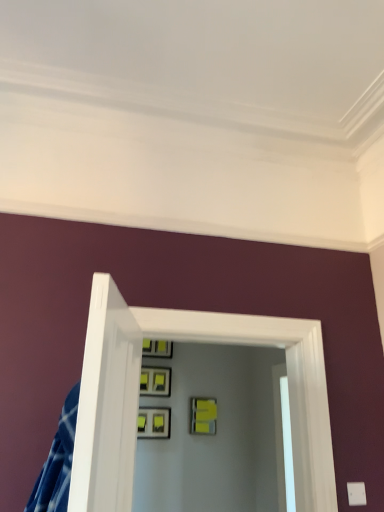
This screenshot has width=384, height=512. What do you see at coordinates (138, 396) in the screenshot?
I see `clear glass door at center` at bounding box center [138, 396].

Find the location of `matte black picture frame at upper center, which is the fourth picture frame in bottom-to-top order`. matte black picture frame at upper center, which is the fourth picture frame in bottom-to-top order is located at coordinates (157, 348).

In order to face matte yellow picture frame at center, positioned as the 2th picture frame in bottom-to-top order, should I rotate leftwards or rightwards?

To face it directly, rotate right by 1.646 degrees.

Locate an element on the screen. This screenshot has width=384, height=512. matte gray picture frame at center, positioned as the 1th picture frame in bottom-to-top order is located at coordinates (153, 422).

What are the coordinates of `clear glass door at center` in the screenshot? It's located at (138, 396).

Is point (155, 356) less distant than point (167, 390)?

No.

Which object is positioned more to the right, matte black picture frame at upper center, the first picture frame positioned from the top, or matte black picture frame at center, the 2th picture frame viewed from the top?

Positioned to the right is matte black picture frame at upper center, the first picture frame positioned from the top.

Is matte black picture frame at upper center, the first picture frame positioned from the top, bigger than matte black picture frame at center, which appears as the 3th picture frame when ordered from the bottom?

Correct, matte black picture frame at upper center, the first picture frame positioned from the top, is larger in size than matte black picture frame at center, which appears as the 3th picture frame when ordered from the bottom.

Is the position of matte black picture frame at center, the 2th picture frame viewed from the top, more distant than that of matte gray picture frame at center, positioned as the 1th picture frame in bottom-to-top order?

Yes, matte black picture frame at center, the 2th picture frame viewed from the top, is further from the camera.

The width and height of the screenshot is (384, 512). What are the coordinates of `picture frame that appears on the left of matte black picture frame at center, the 2th picture frame viewed from the top` in the screenshot? It's located at (153, 422).

Between point (153, 372) and point (140, 411), which one is positioned in front?

The point (140, 411) is closer to the camera.

Is matte black picture frame at center, which appears as the 3th picture frame when ordered from the bottom, to the right of matte gray picture frame at center, the fourth picture frame when ordered from top to bottom, from the viewer's perspective?

Yes.

Considering the relative positions of matte gray picture frame at center, positioned as the 1th picture frame in bottom-to-top order, and matte yellow picture frame at center, the 3th picture frame from the top, in the image provided, is matte gray picture frame at center, positioned as the 1th picture frame in bottom-to-top order, behind matte yellow picture frame at center, the 3th picture frame from the top,?

No, matte gray picture frame at center, positioned as the 1th picture frame in bottom-to-top order, is closer to the viewer.

In the scene shown: Can you see matte gray picture frame at center, positioned as the 1th picture frame in bottom-to-top order, touching matte yellow picture frame at center, the 3th picture frame from the top?

No, matte gray picture frame at center, positioned as the 1th picture frame in bottom-to-top order, is not touching matte yellow picture frame at center, the 3th picture frame from the top.

Could you tell me if matte gray picture frame at center, positioned as the 1th picture frame in bottom-to-top order, is turned towards matte yellow picture frame at center, the 3th picture frame from the top?

No, matte gray picture frame at center, positioned as the 1th picture frame in bottom-to-top order, is not aimed at matte yellow picture frame at center, the 3th picture frame from the top.

Is point (164, 421) less distant than point (159, 350)?

Yes, point (164, 421) is closer to viewer.

Considering the sizes of matte gray picture frame at center, positioned as the 1th picture frame in bottom-to-top order, and matte black picture frame at upper center, which is the fourth picture frame in bottom-to-top order, in the image, is matte gray picture frame at center, positioned as the 1th picture frame in bottom-to-top order, taller or shorter than matte black picture frame at upper center, which is the fourth picture frame in bottom-to-top order,?

Clearly, matte gray picture frame at center, positioned as the 1th picture frame in bottom-to-top order, is shorter compared to matte black picture frame at upper center, which is the fourth picture frame in bottom-to-top order.

From the image's perspective, is matte gray picture frame at center, positioned as the 1th picture frame in bottom-to-top order, beneath matte black picture frame at upper center, which is the fourth picture frame in bottom-to-top order?

Yes, from the image's perspective, matte gray picture frame at center, positioned as the 1th picture frame in bottom-to-top order, is beneath matte black picture frame at upper center, which is the fourth picture frame in bottom-to-top order.

Could matte black picture frame at upper center, which is the fourth picture frame in bottom-to-top order, be considered to be inside matte gray picture frame at center, the fourth picture frame when ordered from top to bottom?

No.

In the scene shown: Is matte yellow picture frame at center, positioned as the 2th picture frame in bottom-to-top order, taller than matte black picture frame at upper center, which is the fourth picture frame in bottom-to-top order?

Correct, matte yellow picture frame at center, positioned as the 2th picture frame in bottom-to-top order, is much taller as matte black picture frame at upper center, which is the fourth picture frame in bottom-to-top order.

From the matte black picture frame at upper center, the first picture frame positioned from the top, count 1st picture frames forward and point to it. Please provide its 2D coordinates.

[(203, 416)]

From the image's perspective, who appears lower, matte yellow picture frame at center, the 3th picture frame from the top, or matte black picture frame at upper center, the first picture frame positioned from the top?

matte yellow picture frame at center, the 3th picture frame from the top.

Based on the photo, is matte yellow picture frame at center, positioned as the 2th picture frame in bottom-to-top order, far away from clear glass door at center?

Absolutely, matte yellow picture frame at center, positioned as the 2th picture frame in bottom-to-top order, is distant from clear glass door at center.

Considering the positions of point (198, 433) and point (100, 464), is point (198, 433) closer or farther from the camera than point (100, 464)?

Point (198, 433) is positioned farther from the camera compared to point (100, 464).

Could you tell me if matte yellow picture frame at center, the 3th picture frame from the top, is facing clear glass door at center?

Yes, matte yellow picture frame at center, the 3th picture frame from the top, is oriented towards clear glass door at center.

From a real-world perspective, is matte yellow picture frame at center, positioned as the 2th picture frame in bottom-to-top order, over clear glass door at center?

No, from a real-world perspective, matte yellow picture frame at center, positioned as the 2th picture frame in bottom-to-top order, is not over clear glass door at center

From the image's perspective, is matte black picture frame at center, which appears as the 3th picture frame when ordered from the bottom, above matte black picture frame at upper center, which is the fourth picture frame in bottom-to-top order?

Actually, matte black picture frame at center, which appears as the 3th picture frame when ordered from the bottom, appears below matte black picture frame at upper center, which is the fourth picture frame in bottom-to-top order, in the image.

Is there a large distance between matte black picture frame at center, which appears as the 3th picture frame when ordered from the bottom, and matte black picture frame at upper center, which is the fourth picture frame in bottom-to-top order?

They are positioned close to each other.

Considering their positions, is matte black picture frame at center, which appears as the 3th picture frame when ordered from the bottom, located in front of or behind matte black picture frame at upper center, the first picture frame positioned from the top?

Clearly, matte black picture frame at center, which appears as the 3th picture frame when ordered from the bottom, is in front of matte black picture frame at upper center, the first picture frame positioned from the top.

The width and height of the screenshot is (384, 512). Find the location of `the 2nd picture frame behind the matte black picture frame at center, which appears as the 3th picture frame when ordered from the bottom, starting your count from the anchor`. the 2nd picture frame behind the matte black picture frame at center, which appears as the 3th picture frame when ordered from the bottom, starting your count from the anchor is located at coordinates (157, 348).

The height and width of the screenshot is (512, 384). I want to click on the 2nd picture frame positioned above the matte gray picture frame at center, positioned as the 1th picture frame in bottom-to-top order (from the image's perspective), so click(x=155, y=381).

Considering their positions, is matte yellow picture frame at center, the 3th picture frame from the top, positioned further to matte black picture frame at upper center, which is the fourth picture frame in bottom-to-top order, than clear glass door at center?

clear glass door at center.

When comparing their distances from clear glass door at center, does matte gray picture frame at center, positioned as the 1th picture frame in bottom-to-top order, or matte black picture frame at center, the 2th picture frame viewed from the top, seem further?

Based on the image, matte black picture frame at center, the 2th picture frame viewed from the top, appears to be further to clear glass door at center.

From the image, which object appears to be farther from matte black picture frame at center, which appears as the 3th picture frame when ordered from the bottom, matte black picture frame at upper center, the first picture frame positioned from the top, or clear glass door at center?

Among the two, clear glass door at center is located further to matte black picture frame at center, which appears as the 3th picture frame when ordered from the bottom.

When comparing their distances from matte gray picture frame at center, positioned as the 1th picture frame in bottom-to-top order, does matte yellow picture frame at center, positioned as the 2th picture frame in bottom-to-top order, or matte black picture frame at center, which appears as the 3th picture frame when ordered from the bottom, seem closer?

matte black picture frame at center, which appears as the 3th picture frame when ordered from the bottom, lies closer to matte gray picture frame at center, positioned as the 1th picture frame in bottom-to-top order, than the other object.

Based on the photo, from the image, which object appears to be farther from matte gray picture frame at center, the fourth picture frame when ordered from top to bottom, clear glass door at center or matte black picture frame at center, the 2th picture frame viewed from the top?

clear glass door at center.

From the image, which object appears to be nearer to matte gray picture frame at center, positioned as the 1th picture frame in bottom-to-top order, matte black picture frame at upper center, the first picture frame positioned from the top, or matte yellow picture frame at center, positioned as the 2th picture frame in bottom-to-top order?

Based on the image, matte yellow picture frame at center, positioned as the 2th picture frame in bottom-to-top order, appears to be nearer to matte gray picture frame at center, positioned as the 1th picture frame in bottom-to-top order.

Considering their positions, is matte black picture frame at upper center, which is the fourth picture frame in bottom-to-top order, positioned further to matte gray picture frame at center, the fourth picture frame when ordered from top to bottom, than matte black picture frame at center, the 2th picture frame viewed from the top?

Among the two, matte black picture frame at upper center, which is the fourth picture frame in bottom-to-top order, is located further to matte gray picture frame at center, the fourth picture frame when ordered from top to bottom.

Based on their spatial positions, is clear glass door at center or matte black picture frame at upper center, the first picture frame positioned from the top, further from matte gray picture frame at center, positioned as the 1th picture frame in bottom-to-top order?

Among the two, clear glass door at center is located further to matte gray picture frame at center, positioned as the 1th picture frame in bottom-to-top order.

The image size is (384, 512). Identify the location of picture frame between clear glass door at center and matte black picture frame at center, which appears as the 3th picture frame when ordered from the bottom, along the z-axis. (153, 422).

Where is `picture frame between matte black picture frame at upper center, which is the fourth picture frame in bottom-to-top order, and matte yellow picture frame at center, the 3th picture frame from the top, in the up-down direction`? Image resolution: width=384 pixels, height=512 pixels. picture frame between matte black picture frame at upper center, which is the fourth picture frame in bottom-to-top order, and matte yellow picture frame at center, the 3th picture frame from the top, in the up-down direction is located at coordinates (155, 381).